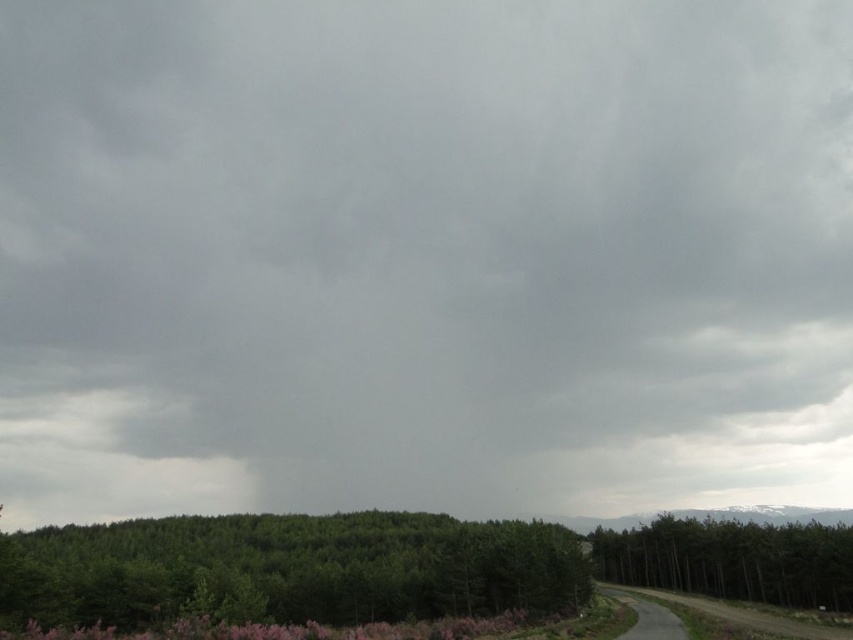
Question: Which of the following is the farthest from the observer?

Choices:
 (A) green matte tree at lower center
 (B) green matte tree at right

Answer: (B)

Question: Where is green matte tree at lower center located in relation to green matte tree at right in the image?

Choices:
 (A) right
 (B) left

Answer: (B)

Question: Considering the relative positions of green matte tree at lower center and green matte tree at right in the image provided, where is green matte tree at lower center located with respect to green matte tree at right?

Choices:
 (A) above
 (B) below

Answer: (A)

Question: Which point is farther from the camera taking this photo?

Choices:
 (A) (717, 524)
 (B) (102, 588)

Answer: (A)

Question: Which of the following is the closest to the observer?

Choices:
 (A) green matte tree at lower center
 (B) green matte tree at right

Answer: (A)

Question: Is green matte tree at lower center smaller than green matte tree at right?

Choices:
 (A) yes
 (B) no

Answer: (B)